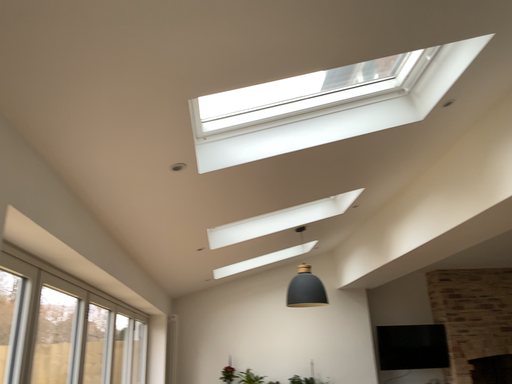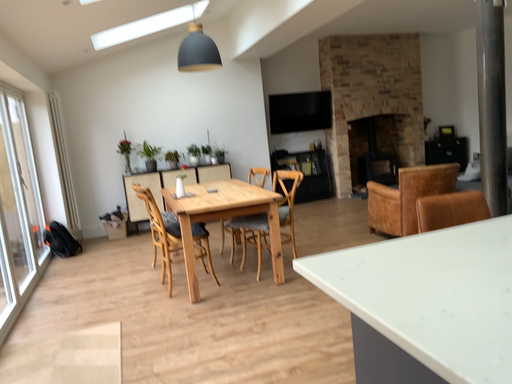
Question: How did the camera likely rotate when shooting the video?

Choices:
 (A) rotated right
 (B) rotated left

Answer: (A)